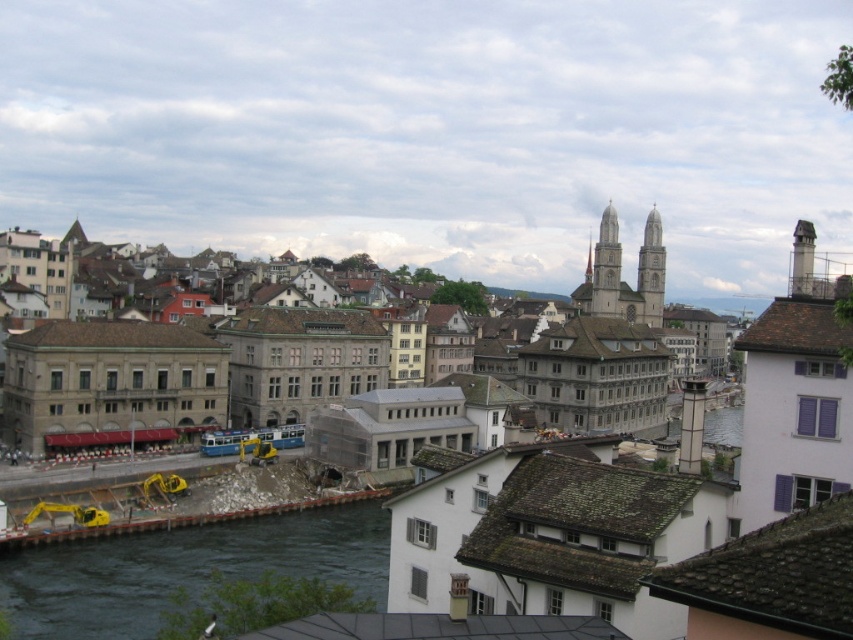
Question: Observing the image, what is the correct spatial positioning of matte gray building at center in reference to dark blue water at lower left?

Choices:
 (A) right
 (B) left

Answer: (A)

Question: Which point appears closest to the camera in this image?

Choices:
 (A) (679, 488)
 (B) (143, 552)

Answer: (A)

Question: Which point is closer to the camera?

Choices:
 (A) (573, 545)
 (B) (170, 554)

Answer: (A)

Question: Does matte gray building at center come behind dark blue water at lower left?

Choices:
 (A) no
 (B) yes

Answer: (A)

Question: Is matte gray building at center bigger than dark blue water at lower left?

Choices:
 (A) yes
 (B) no

Answer: (A)